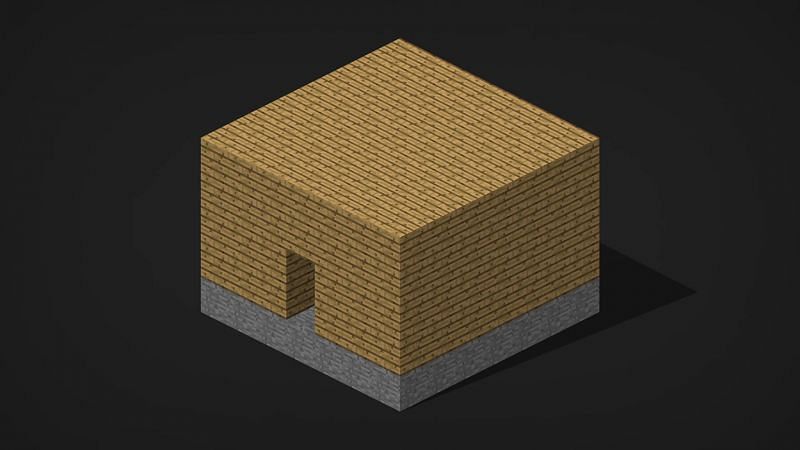
Locate an element on the screen. The image size is (800, 450). brown box top is located at coordinates (374, 303).